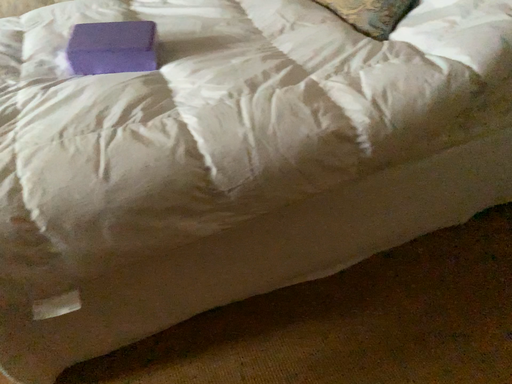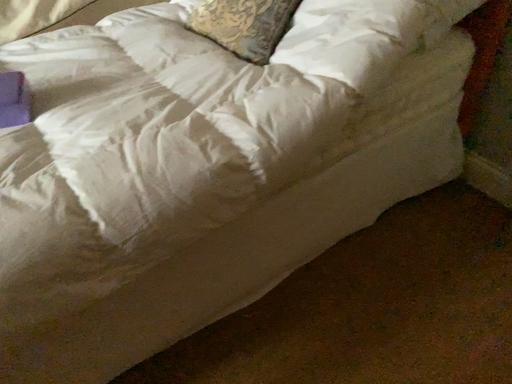
Question: How did the camera likely rotate when shooting the video?

Choices:
 (A) rotated left
 (B) rotated right

Answer: (B)